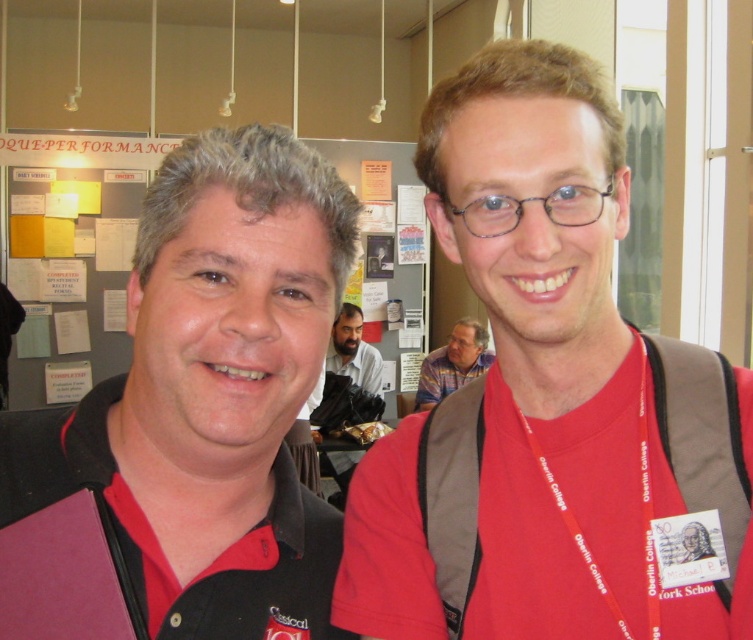
Who is more forward, (136,497) or (547,484)?

Positioned in front is point (136,497).

Is matte black polo shirt at left smaller than red lanyard at right?

Actually, matte black polo shirt at left might be larger than red lanyard at right.

The image size is (753, 640). I want to click on matte black polo shirt at left, so click(x=197, y=413).

This screenshot has height=640, width=753. Identify the location of matte black polo shirt at left. (197, 413).

Is matte black polo shirt at left shorter than bearded man at center?

Correct, matte black polo shirt at left is not as tall as bearded man at center.

Describe the element at coordinates (197, 413) in the screenshot. I see `matte black polo shirt at left` at that location.

Is point (209, 154) closer to camera compared to point (357, 385)?

Yes, point (209, 154) is in front of point (357, 385).

Find the location of a particular element. The width and height of the screenshot is (753, 640). matte black polo shirt at left is located at coordinates (197, 413).

Is point (526, 541) less distant than point (470, 378)?

Yes, it is in front of point (470, 378).

Which is more to the left, matte red shirt at center or striped fabric shirt at center?

matte red shirt at center is more to the left.

Locate an element on the screen. This screenshot has height=640, width=753. matte red shirt at center is located at coordinates (550, 403).